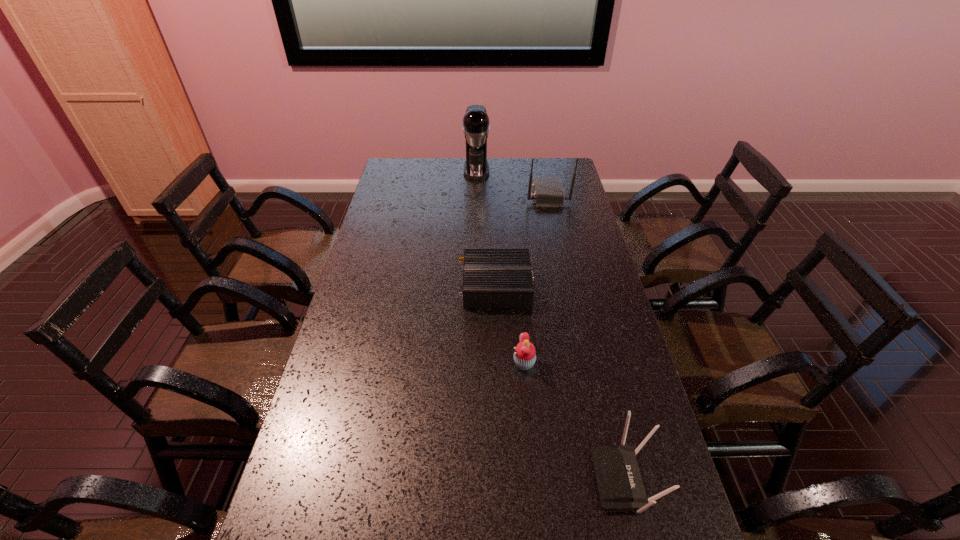
Locate an element on the screen. The image size is (960, 540). free space located 0.240m on the back panel of the shortest object is located at coordinates (388, 286).

In order to click on vacant space situated 0.080m on the back panel of the shortest object in this screenshot , I will do `click(435, 286)`.

Locate an element on the screen. This screenshot has width=960, height=540. vacant space located on the back panel of the shortest object is located at coordinates (367, 286).

Find the location of a particular element. object present at the far edge is located at coordinates (476, 127).

In the image, there is a desktop. Where is `free space at the far edge`? free space at the far edge is located at coordinates (425, 159).

In the image, there is a desktop. Identify the location of vacant space at the left edge. (399, 217).

The width and height of the screenshot is (960, 540). I want to click on vacant space at the right edge, so click(640, 443).

Locate an element on the screen. This screenshot has height=540, width=960. free space at the far left corner of the desktop is located at coordinates (412, 166).

The image size is (960, 540). I want to click on free point between the tallest router and the tallest object, so click(512, 183).

The height and width of the screenshot is (540, 960). In order to click on vacant area that lies between the tallest object and the third tallest object in this screenshot , I will do `click(551, 325)`.